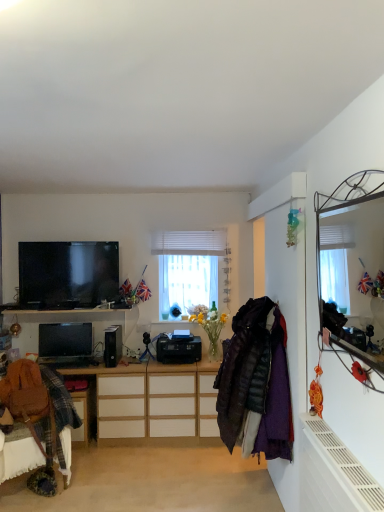
Identify the location of vacant region below black plastic speaker at center (from a real-world perspective). (120, 360).